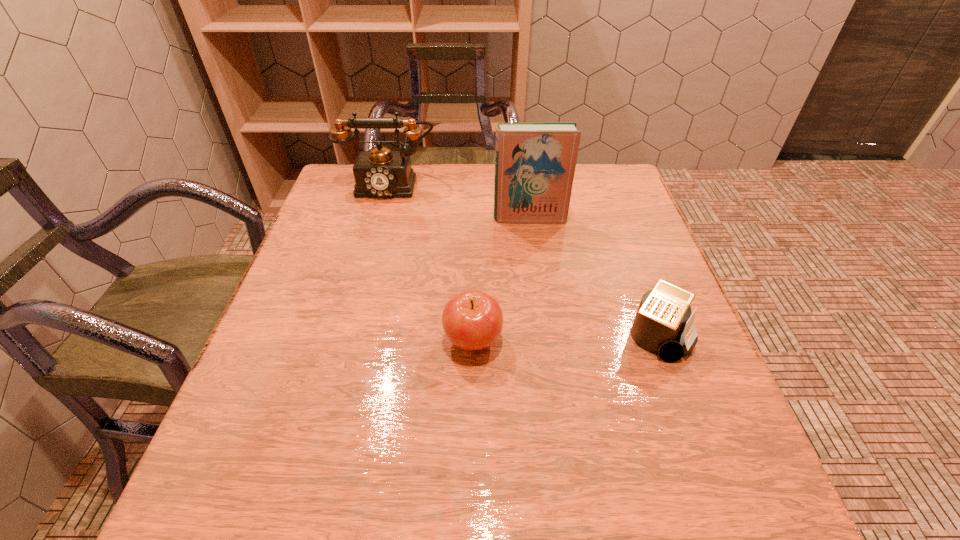
Choose which object is the second nearest neighbor to the leftmost object. Please provide its 2D coordinates. Your answer should be formatted as a tuple, i.e. [(x, y)], where the tuple contains the x and y coordinates of a point satisfying the conditions above.

[(472, 320)]

What are the coordinates of `free spot that satisfies the following two spatial constraints: 1. on the back side of the third tallest object; 2. on the right side of the rightmost object` in the screenshot? It's located at (473, 336).

Identify the location of free point that satisfies the following two spatial constraints: 1. on the front of the telephone at the rotary dial; 2. on the left side of the third tallest object. (348, 341).

You are a GUI agent. You are given a task and a screenshot of the screen. Output one action in this format:
    pyautogui.click(x=<x>, y=<y>)
    Task: Click on the free space that satisfies the following two spatial constraints: 1. on the front of the shortest object at the rotary dial; 2. on the right side of the leftmost object
    The image size is (960, 540).
    Given the screenshot: What is the action you would take?
    pyautogui.click(x=348, y=336)

Find the location of a particular element. This screenshot has width=960, height=540. blank area in the image that satisfies the following two spatial constraints: 1. on the front of the second tallest object at the rotary dial; 2. on the right side of the shortest object is located at coordinates (348, 336).

Locate an element on the screen. free point that satisfies the following two spatial constraints: 1. on the cover of the shortest object; 2. on the right side of the tallest object is located at coordinates (545, 336).

Image resolution: width=960 pixels, height=540 pixels. In order to click on free space that satisfies the following two spatial constraints: 1. on the cover of the tallest object; 2. on the left side of the rightmost object in this screenshot , I will do `click(545, 336)`.